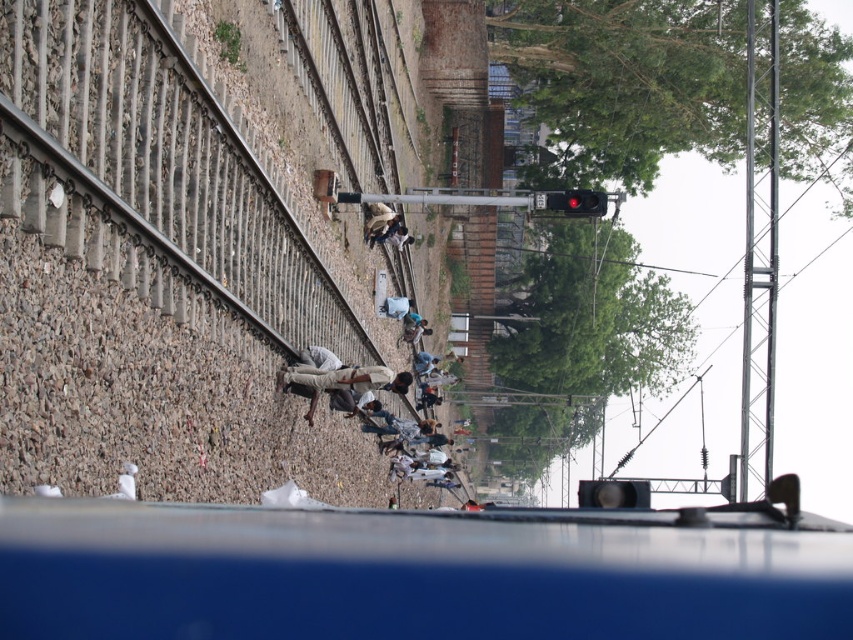
Question: Which point is farther to the camera?

Choices:
 (A) (392, 305)
 (B) (422, 374)
 (C) (560, 192)
 (D) (390, 237)

Answer: (B)

Question: Is light blue fabric at center thinner than blue fabric shirt at center?

Choices:
 (A) yes
 (B) no

Answer: (B)

Question: Does black plastic traffic light at center appear on the left side of light beige fabric at center?

Choices:
 (A) no
 (B) yes

Answer: (A)

Question: Which of the following is the closest to the observer?

Choices:
 (A) (434, 355)
 (B) (401, 234)
 (C) (601, 497)
 (D) (589, 211)

Answer: (C)

Question: Does red glass traffic light at upper center appear on the left side of light blue fabric at center?

Choices:
 (A) no
 (B) yes

Answer: (A)

Question: Which of the following is the farthest from the observer?

Choices:
 (A) black plastic traffic light at center
 (B) light blue fabric at center
 (C) blue fabric shirt at center

Answer: (C)